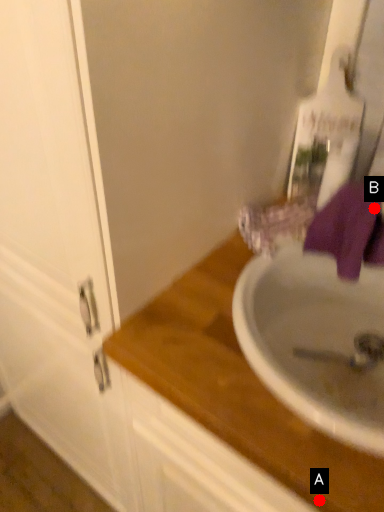
Question: Two points are circled on the image, labeled by A and B beside each circle. Among these points, which one is farthest from the camera?

Choices:
 (A) A is further
 (B) B is further

Answer: (B)